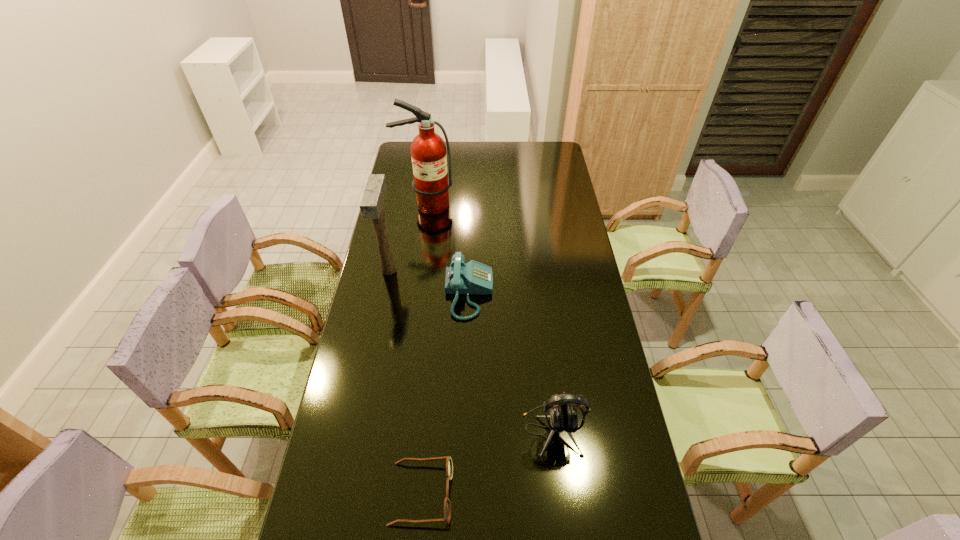
I want to click on vacant space positioned 0.300m on the left of the earphone, so click(420, 431).

Image resolution: width=960 pixels, height=540 pixels. I want to click on vacant region located 0.280m on the dial of the telephone, so click(x=568, y=293).

Locate an element on the screen. Image resolution: width=960 pixels, height=540 pixels. vacant space located on the front-facing side of the shortest object is located at coordinates pos(475,493).

The image size is (960, 540). I want to click on fire extinguisher that is at the left edge, so click(431, 183).

Locate an element on the screen. The height and width of the screenshot is (540, 960). mallet present at the left edge is located at coordinates (371, 206).

Where is `object that is positioned at the right edge`? object that is positioned at the right edge is located at coordinates (563, 417).

The height and width of the screenshot is (540, 960). Find the location of `vacant area at the far edge`. vacant area at the far edge is located at coordinates (520, 150).

Image resolution: width=960 pixels, height=540 pixels. I want to click on vacant space at the left edge of the desktop, so click(357, 431).

You are a GUI agent. You are given a task and a screenshot of the screen. Output one action in this format:
    pyautogui.click(x=<x>, y=<y>)
    Task: Click on the vacant space at the right edge of the desktop
    
    Given the screenshot: What is the action you would take?
    pyautogui.click(x=619, y=388)

At what (x,y) coordinates should I click in order to perform the action: click on vacant space that is in between the tallest object and the nearest object. Please return your answer as a coordinate pair (x, y). The width and height of the screenshot is (960, 540). Looking at the image, I should click on (423, 349).